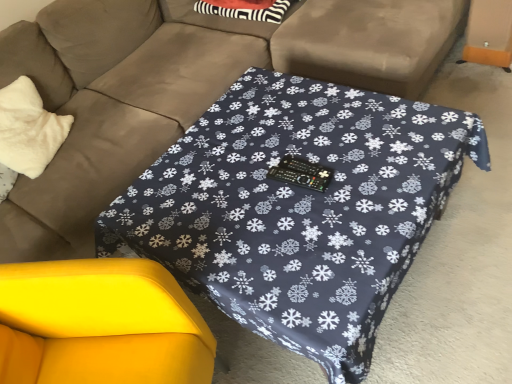
Where is `free space above dark blue fabric table at center (from a real-world perspective)`? free space above dark blue fabric table at center (from a real-world perspective) is located at coordinates (273, 177).